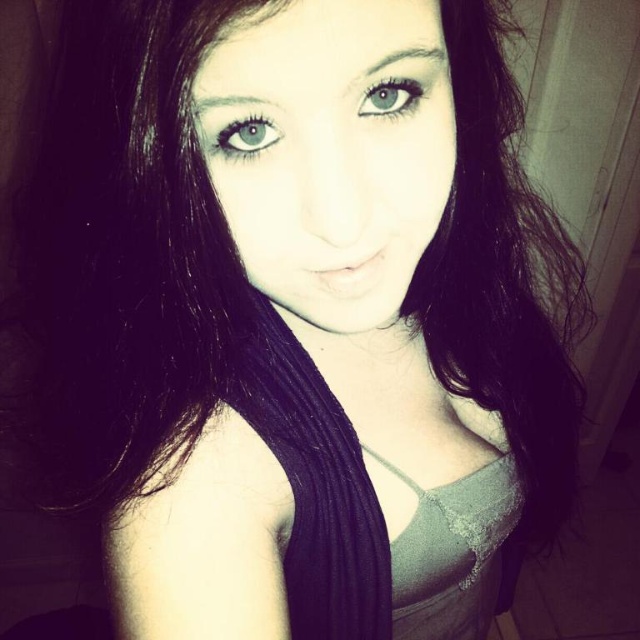
Question: Which of the following is the farthest from the observer?

Choices:
 (A) blue matte eye at upper center
 (B) gray lace dress at center
 (C) green matte eye at upper center

Answer: (B)

Question: Observing the image, what is the correct spatial positioning of gray lace dress at center in reference to green matte eye at upper center?

Choices:
 (A) left
 (B) right

Answer: (B)

Question: Can you confirm if gray lace dress at center is wider than green matte eye at upper center?

Choices:
 (A) yes
 (B) no

Answer: (A)

Question: Which is farther from the gray lace dress at center?

Choices:
 (A) green matte eye at upper center
 (B) blue matte eye at upper center

Answer: (A)

Question: Does gray lace dress at center lie in front of blue matte eye at upper center?

Choices:
 (A) yes
 (B) no

Answer: (B)

Question: Which point is farther to the camera?

Choices:
 (A) blue matte eye at upper center
 (B) gray lace dress at center

Answer: (B)